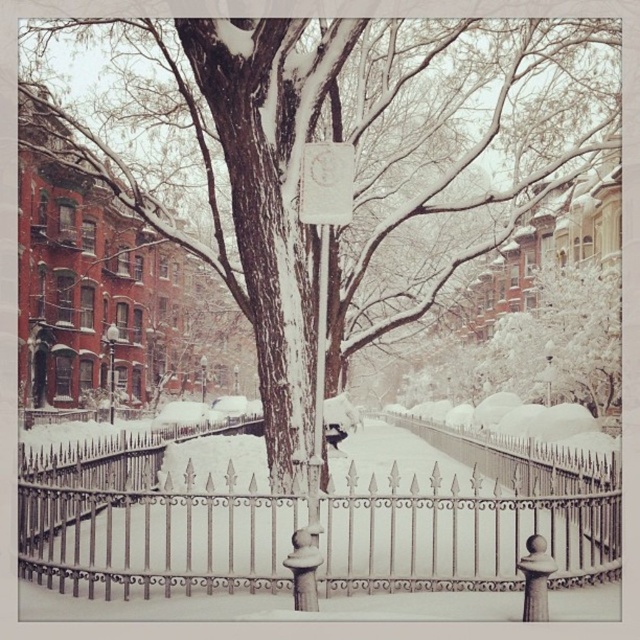
Which is above, snow-covered bark at center or white paper at center?

snow-covered bark at center

Between snow-covered bark at center and white paper at center, which one appears on the right side from the viewer's perspective?

Positioned to the right is white paper at center.

I want to click on snow-covered bark at center, so click(x=356, y=157).

Can you confirm if snow-covered bark at center is shorter than white matte sign at center?

No.

Is snow-covered bark at center taller than white matte sign at center?

Yes, snow-covered bark at center is taller than white matte sign at center.

This screenshot has height=640, width=640. What do you see at coordinates (356, 157) in the screenshot?
I see `snow-covered bark at center` at bounding box center [356, 157].

You are a GUI agent. You are given a task and a screenshot of the screen. Output one action in this format:
    pyautogui.click(x=<x>, y=<y>)
    Task: Click on the snow-covered bark at center
    The image size is (640, 640).
    Given the screenshot: What is the action you would take?
    pyautogui.click(x=356, y=157)

Is white paper at center to the left of white matte sign at center from the viewer's perspective?

Incorrect, white paper at center is not on the left side of white matte sign at center.

Looking at this image, can you confirm if white paper at center is shorter than white matte sign at center?

No, white paper at center is not shorter than white matte sign at center.

Which is in front, point (342, 176) or point (320, 305)?

Point (342, 176) is in front.

I want to click on white paper at center, so click(326, 182).